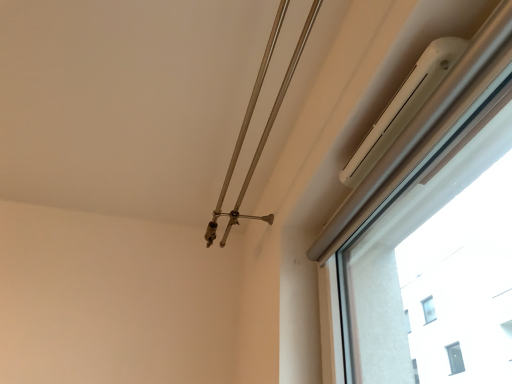
What is the approximate height of metallic silver rod at upper center?

3.69 inches.

Describe the element at coordinates (266, 123) in the screenshot. I see `metallic silver rod at upper center` at that location.

Measure the distance between point [243,131] and camera.

A distance of 1.13 meters exists between point [243,131] and camera.

Where is `metallic silver rod at upper center`? metallic silver rod at upper center is located at coordinates (266, 123).

You are a GUI agent. You are given a task and a screenshot of the screen. Output one action in this format:
    pyautogui.click(x=<x>, y=<y>)
    Task: Click on the white plastic air conditioner at upper right
    The height and width of the screenshot is (384, 512).
    Given the screenshot: What is the action you would take?
    pyautogui.click(x=410, y=204)

What do you see at coordinates (410, 204) in the screenshot? I see `white plastic air conditioner at upper right` at bounding box center [410, 204].

What are the coordinates of `metallic silver rod at upper center` in the screenshot? It's located at (266, 123).

Is metallic silver rod at upper center to the left of white plastic air conditioner at upper right from the viewer's perspective?

Yes, metallic silver rod at upper center is to the left of white plastic air conditioner at upper right.

Does metallic silver rod at upper center lie in front of white plastic air conditioner at upper right?

No, it is not.

Is point (252, 163) positioned before point (463, 123)?

No.

From the image's perspective, which is above, metallic silver rod at upper center or white plastic air conditioner at upper right?

white plastic air conditioner at upper right.

From a real-world perspective, relative to white plastic air conditioner at upper right, is metallic silver rod at upper center vertically above or below?

Clearly, from a real-world perspective, metallic silver rod at upper center is above white plastic air conditioner at upper right.

Between metallic silver rod at upper center and white plastic air conditioner at upper right, which one has smaller width?

Thinner between the two is white plastic air conditioner at upper right.

Is metallic silver rod at upper center taller than white plastic air conditioner at upper right?

Correct, metallic silver rod at upper center is much taller as white plastic air conditioner at upper right.

Considering the relative sizes of metallic silver rod at upper center and white plastic air conditioner at upper right in the image provided, is metallic silver rod at upper center smaller than white plastic air conditioner at upper right?

Actually, metallic silver rod at upper center might be larger than white plastic air conditioner at upper right.

Is metallic silver rod at upper center completely or partially outside of white plastic air conditioner at upper right?

metallic silver rod at upper center lies outside white plastic air conditioner at upper right's area.

Are metallic silver rod at upper center and white plastic air conditioner at upper right located far from each other?

That's not correct — metallic silver rod at upper center is a little close to white plastic air conditioner at upper right.

Is metallic silver rod at upper center aimed at white plastic air conditioner at upper right?

No.

How different are the orientations of metallic silver rod at upper center and white plastic air conditioner at upper right in degrees?

0.581 degrees.

Image resolution: width=512 pixels, height=384 pixels. I want to click on twin positioned vertically above the white plastic air conditioner at upper right (from a real-world perspective), so click(x=266, y=123).

Is white plastic air conditioner at upper right at the left side of metallic silver rod at upper center?

In fact, white plastic air conditioner at upper right is to the right of metallic silver rod at upper center.

Does white plastic air conditioner at upper right lie behind metallic silver rod at upper center?

No, it is in front of metallic silver rod at upper center.

From the picture: Which point is more forward, (342, 340) or (318, 8)?

The point (318, 8) is more forward.

From the image's perspective, is white plastic air conditioner at upper right over metallic silver rod at upper center?

Yes, from the image's perspective, white plastic air conditioner at upper right is on top of metallic silver rod at upper center.

From a real-world perspective, is white plastic air conditioner at upper right below metallic silver rod at upper center?

Indeed, from a real-world perspective, white plastic air conditioner at upper right is positioned beneath metallic silver rod at upper center.

Considering the relative sizes of white plastic air conditioner at upper right and metallic silver rod at upper center in the image provided, is white plastic air conditioner at upper right thinner than metallic silver rod at upper center?

Indeed, white plastic air conditioner at upper right has a lesser width compared to metallic silver rod at upper center.

Considering the sizes of white plastic air conditioner at upper right and metallic silver rod at upper center in the image, is white plastic air conditioner at upper right taller or shorter than metallic silver rod at upper center?

Clearly, white plastic air conditioner at upper right is shorter compared to metallic silver rod at upper center.

Can you confirm if white plastic air conditioner at upper right is bigger than metallic silver rod at upper center?

No.

Can we say white plastic air conditioner at upper right lies outside metallic silver rod at upper center?

Absolutely, white plastic air conditioner at upper right is external to metallic silver rod at upper center.

Can you see white plastic air conditioner at upper right touching metallic silver rod at upper center?

They are not placed beside each other.

Could you tell me if white plastic air conditioner at upper right is turned towards metallic silver rod at upper center?

No, white plastic air conditioner at upper right is not facing towards metallic silver rod at upper center.

How far apart are white plastic air conditioner at upper right and metallic silver rod at upper center?

white plastic air conditioner at upper right and metallic silver rod at upper center are 16.86 inches apart from each other.

Image resolution: width=512 pixels, height=384 pixels. I want to click on twin below the white plastic air conditioner at upper right (from the image's perspective), so click(x=266, y=123).

I want to click on twin that is behind the white plastic air conditioner at upper right, so click(x=266, y=123).

Find the location of `window on the right of metallic silver rod at upper center`. window on the right of metallic silver rod at upper center is located at coordinates (410, 204).